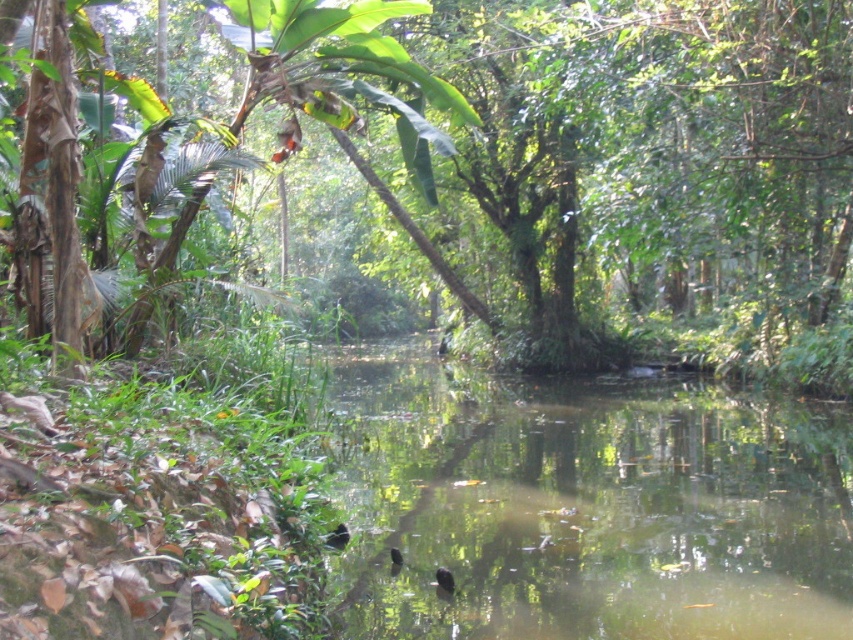
Can you confirm if green reflective water at center is positioned above green leafy tree at center?

Incorrect, green reflective water at center is not positioned above green leafy tree at center.

Measure the distance between point (x=682, y=522) and camera.

31.06 feet

Find the location of `green reflective water at center`. green reflective water at center is located at coordinates (583, 506).

Locate an element on the screen. green reflective water at center is located at coordinates tap(583, 506).